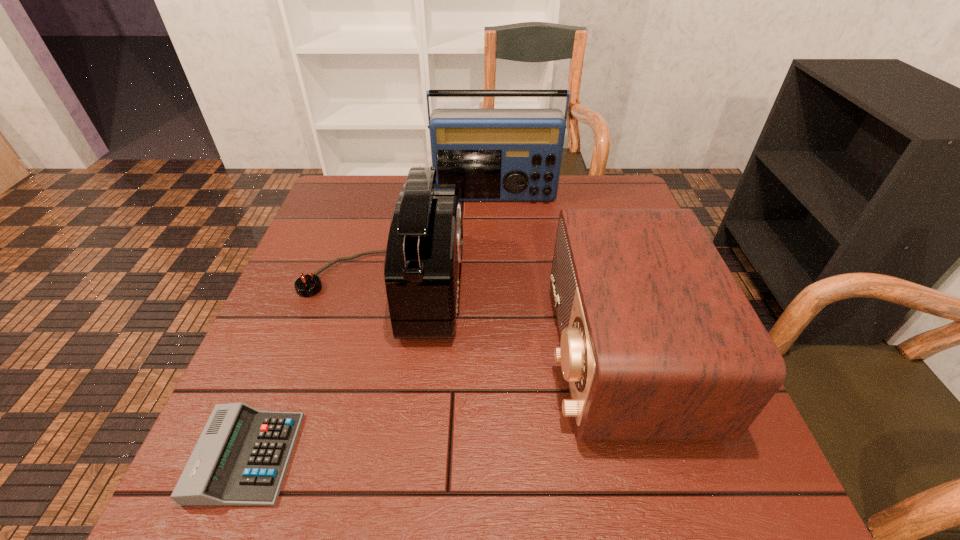
Identify which object is the second closest to the second shortest object. Please provide its 2D coordinates. Your answer should be formatted as a tuple, i.e. [(x, y)], where the tuple contains the x and y coordinates of a point satisfying the conditions above.

[(491, 154)]

I want to click on object that is the third closest to the calculator, so click(491, 154).

Identify which radio receiver is located as the third nearest to the calculator. Please provide its 2D coordinates. Your answer should be formatted as a tuple, i.e. [(x, y)], where the tuple contains the x and y coordinates of a point satisfying the conditions above.

[(491, 154)]

This screenshot has width=960, height=540. Identify the location of the second closest radio receiver to the farthest object. (658, 342).

The image size is (960, 540). Find the location of `free point that satisfies the following two spatial constraints: 1. on the front panel of the farthest object; 2. on the front-facing side of the third shortest object`. free point that satisfies the following two spatial constraints: 1. on the front panel of the farthest object; 2. on the front-facing side of the third shortest object is located at coordinates (499, 286).

The image size is (960, 540). Find the location of `free region that satisfies the following two spatial constraints: 1. on the front panel of the farthest radio receiver; 2. on the front-facing side of the third shortest object`. free region that satisfies the following two spatial constraints: 1. on the front panel of the farthest radio receiver; 2. on the front-facing side of the third shortest object is located at coordinates (499, 286).

Find the location of a particular element. free region that satisfies the following two spatial constraints: 1. on the front panel of the farthest object; 2. on the front-facing side of the second shortest radio receiver is located at coordinates (499, 286).